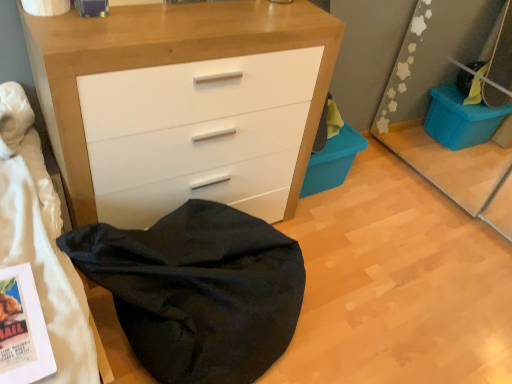
Question: Based on their sizes in the image, would you say blue plastic storage bin at lower right is bigger or smaller than black fabric bean bag at lower left?

Choices:
 (A) small
 (B) big

Answer: (A)

Question: From their relative heights in the image, would you say blue plastic storage bin at lower right is taller or shorter than black fabric bean bag at lower left?

Choices:
 (A) short
 (B) tall

Answer: (A)

Question: Considering the real-world distances, which object is farthest from the blue plastic storage bin at lower right?

Choices:
 (A) matte white chest of drawers at center
 (B) black fabric bean bag at lower left

Answer: (B)

Question: Estimate the real-world distances between objects in this image. Which object is closer to the blue plastic storage bin at lower right?

Choices:
 (A) matte white chest of drawers at center
 (B) black fabric bean bag at lower left

Answer: (A)